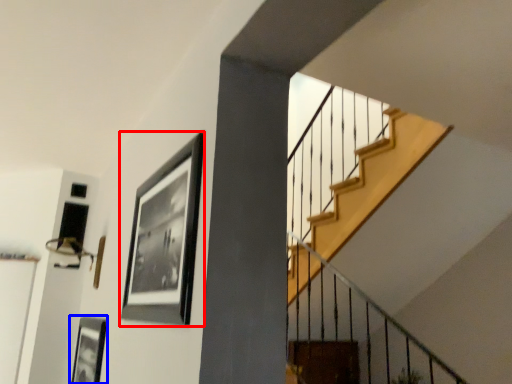
Question: Which object is closer to the camera taking this photo, picture frame (highlighted by a red box) or picture frame (highlighted by a blue box)?

Choices:
 (A) picture frame
 (B) picture frame

Answer: (A)